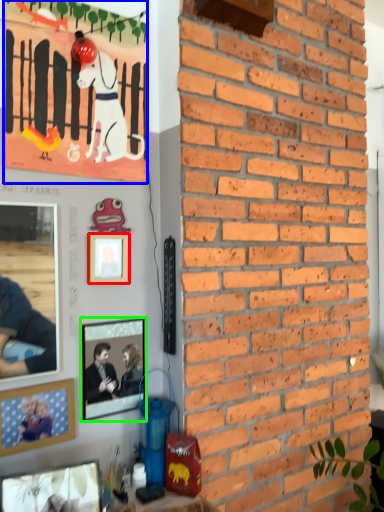
Question: Based on their relative distances, which object is farther from picture frame (highlighted by a red box)? Choose from poster (highlighted by a blue box) and picture frame (highlighted by a green box).

Choices:
 (A) poster
 (B) picture frame

Answer: (A)